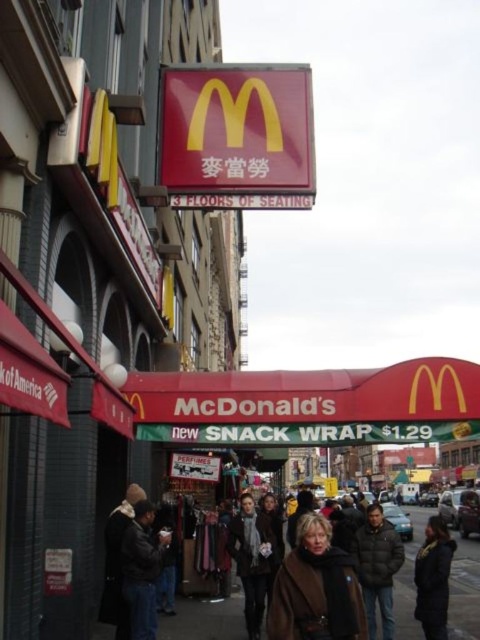
Between matte plastic sign at center and brown leather coat at center, which one appears on the left side from the viewer's perspective?

matte plastic sign at center is more to the left.

Is matte plastic sign at center smaller than brown leather coat at center?

Indeed, matte plastic sign at center has a smaller size compared to brown leather coat at center.

Is point (308, 160) behind point (283, 588)?

Yes, it is behind point (283, 588).

This screenshot has height=640, width=480. Find the location of `matte plastic sign at center`. matte plastic sign at center is located at coordinates (238, 136).

Does brown leather coat at center have a larger size compared to brown leather jacket at lower center?

Actually, brown leather coat at center might be smaller than brown leather jacket at lower center.

Is point (312, 611) closer to viewer compared to point (419, 524)?

Yes, it is.

Is point (326, 628) farther from viewer compared to point (409, 554)?

No, it is in front of (409, 554).

I want to click on brown leather coat at center, so click(x=315, y=589).

Between dark gray scarf at center and metallic silver sign at center, which one has less height?

metallic silver sign at center is shorter.

Where is `dark gray scarf at center`? The width and height of the screenshot is (480, 640). dark gray scarf at center is located at coordinates pos(252,560).

Is point (240, 563) behind point (186, 464)?

No.

Locate an element on the screen. Image resolution: width=480 pixels, height=640 pixels. dark gray scarf at center is located at coordinates (252, 560).